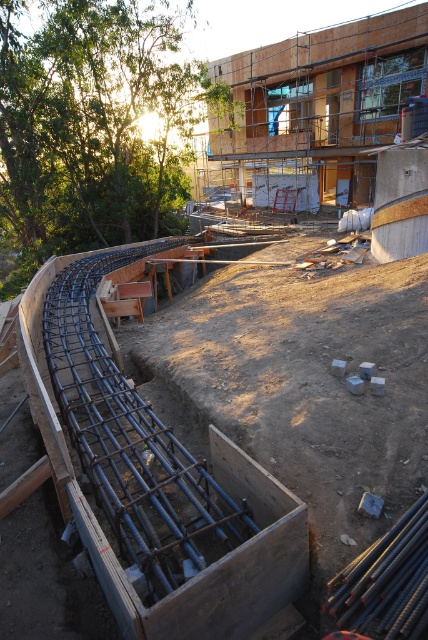
You are an inspector checking the construction site. You notice two items in the image, the black metal rebar at lower left and the wooden scaffolding at upper center. Which one has a smaller width?

The black metal rebar at lower left has a smaller width than the wooden scaffolding at upper center.

You are a construction worker standing at the point marked as point (421,364) on the construction site. You need to move to the safety zone located 5 meters away from your current position. Can you safely reach the safety zone without moving further away from your current position?

The distance between point (421,364) and the viewer is 4.75 meters. Since the safety zone is 5 meters away, you are already within the required distance and can safely stay at your current position without moving further away.